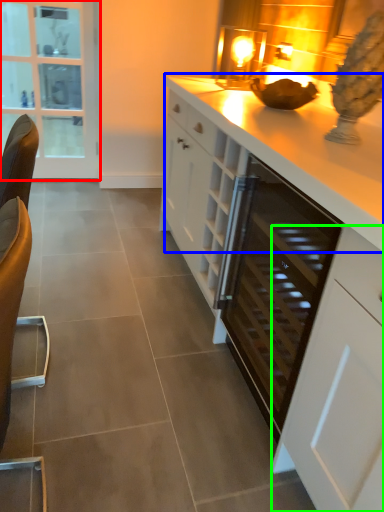
Question: Based on their relative distances, which object is nearer to glass door (highlighted by a red box)? Choose from countertop (highlighted by a blue box) and cabinetry (highlighted by a green box).

Choices:
 (A) countertop
 (B) cabinetry

Answer: (A)